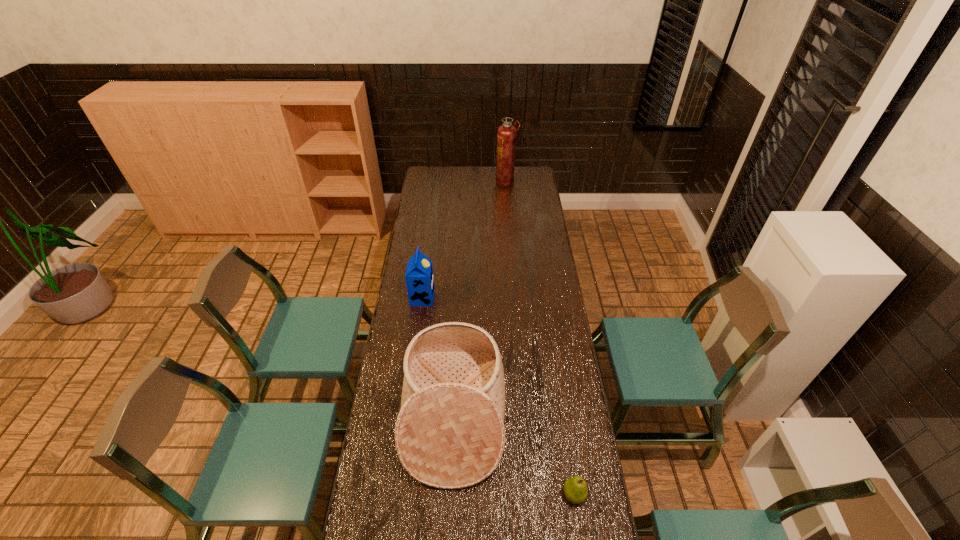
Where is `free region at the right edge of the desktop`? free region at the right edge of the desktop is located at coordinates (525, 197).

Identify the location of blank area at the far left corner. (428, 176).

Where is `vacant area at the far right corner of the desktop`? vacant area at the far right corner of the desktop is located at coordinates (519, 185).

Locate an element on the screen. free area in between the third object from left to right and the basket is located at coordinates tap(480, 299).

Locate an element on the screen. The image size is (960, 540). vacant area that lies between the fire extinguisher and the second farthest object is located at coordinates (464, 240).

You are a GUI agent. You are given a task and a screenshot of the screen. Output one action in this format:
    pyautogui.click(x=<x>, y=<y>)
    Task: Click on the free space between the rightmost object and the basket
    This screenshot has height=540, width=960.
    Given the screenshot: What is the action you would take?
    pyautogui.click(x=514, y=455)

This screenshot has width=960, height=540. I want to click on free space between the second object from right to left and the basket, so click(480, 299).

Identify the location of vacant space in between the third object from left to right and the basket. (480, 299).

You are a GUI agent. You are given a task and a screenshot of the screen. Output one action in this format:
    pyautogui.click(x=<x>, y=<y>)
    Task: Click on the free spot between the basket and the farthest object
    This screenshot has width=960, height=540.
    Given the screenshot: What is the action you would take?
    pyautogui.click(x=480, y=299)

Where is `free space that is in between the basket and the rightmost object`? free space that is in between the basket and the rightmost object is located at coordinates [514, 455].